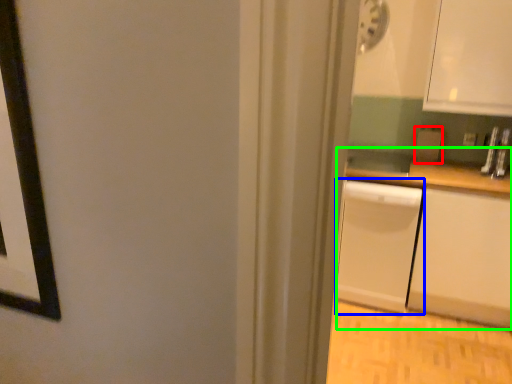
Question: Estimate the real-world distances between objects in this image. Which object is closer to appliance (highlighted by a red box), dish washer (highlighted by a blue box) or counter (highlighted by a green box)?

Choices:
 (A) dish washer
 (B) counter

Answer: (B)